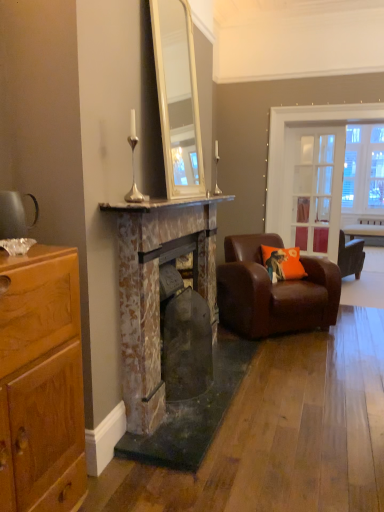
Question: Is the position of shiny brown cabinet at left less distant than that of clear glass door at center?

Choices:
 (A) yes
 (B) no

Answer: (A)

Question: Is shiny brown cabinet at left facing towards clear glass door at center?

Choices:
 (A) yes
 (B) no

Answer: (B)

Question: Is shiny brown cabinet at left thinner than clear glass door at center?

Choices:
 (A) no
 (B) yes

Answer: (A)

Question: Would you say shiny brown cabinet at left is outside clear glass door at center?

Choices:
 (A) no
 (B) yes

Answer: (B)

Question: From the image's perspective, is shiny brown cabinet at left on clear glass door at center?

Choices:
 (A) no
 (B) yes

Answer: (A)

Question: Can you confirm if shiny brown cabinet at left is smaller than clear glass door at center?

Choices:
 (A) yes
 (B) no

Answer: (B)

Question: Considering the relative positions of silver metallic candlestick at upper center, which is counted as the 2th table lamp, starting from the right, and orange fabric pillow at right in the image provided, is silver metallic candlestick at upper center, which is counted as the 2th table lamp, starting from the right, to the left of orange fabric pillow at right from the viewer's perspective?

Choices:
 (A) no
 (B) yes

Answer: (B)

Question: Does silver metallic candlestick at upper center, arranged as the first table lamp when viewed from the front, have a greater height compared to orange fabric pillow at right?

Choices:
 (A) yes
 (B) no

Answer: (A)

Question: From a real-world perspective, is silver metallic candlestick at upper center, positioned as the first table lamp in left-to-right order, positioned under orange fabric pillow at right based on gravity?

Choices:
 (A) yes
 (B) no

Answer: (B)

Question: From a real-world perspective, is silver metallic candlestick at upper center, which is counted as the 2th table lamp, starting from the right, on top of orange fabric pillow at right?

Choices:
 (A) no
 (B) yes

Answer: (B)

Question: Can you see silver metallic candlestick at upper center, arranged as the first table lamp when viewed from the front, touching orange fabric pillow at right?

Choices:
 (A) yes
 (B) no

Answer: (B)

Question: Does silver metallic candlestick at upper center, the second table lamp when ordered from back to front, have a lesser width compared to orange fabric pillow at right?

Choices:
 (A) no
 (B) yes

Answer: (B)

Question: Does marble mantel at center have a lesser width compared to silver metallic candlestick at upper center, which is counted as the 2th table lamp, starting from the right?

Choices:
 (A) no
 (B) yes

Answer: (A)